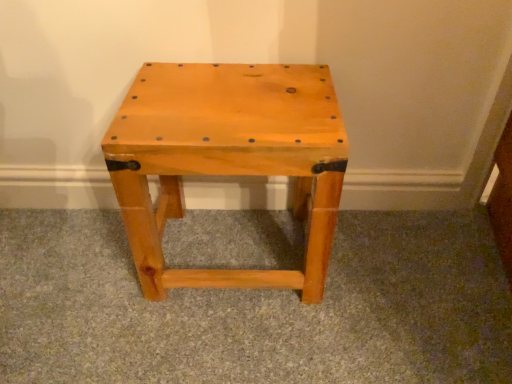
Locate an element on the screen. Image resolution: width=512 pixels, height=384 pixels. free spot to the right of natural wood stool at center is located at coordinates (395, 271).